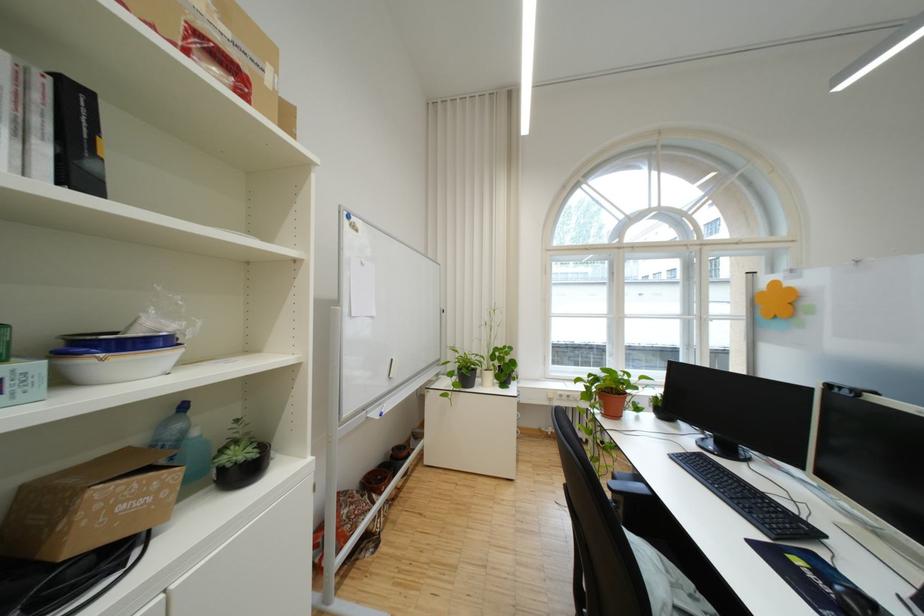
Find where to lift the whiteboard eraser. Please return your answer as a coordinate pair (x, y).

(377, 411)